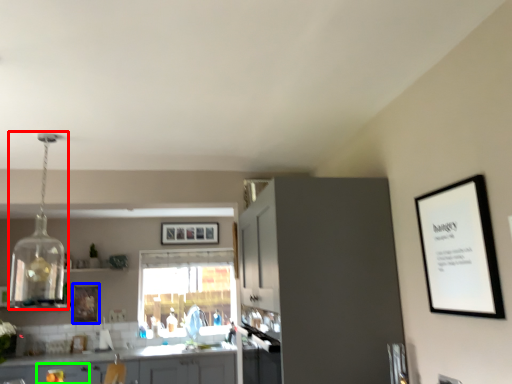
Question: Which object is the farthest from light fixture (highlighted by a red box)? Choose among these: picture frame (highlighted by a blue box) or drawer (highlighted by a green box).

Choices:
 (A) picture frame
 (B) drawer

Answer: (B)